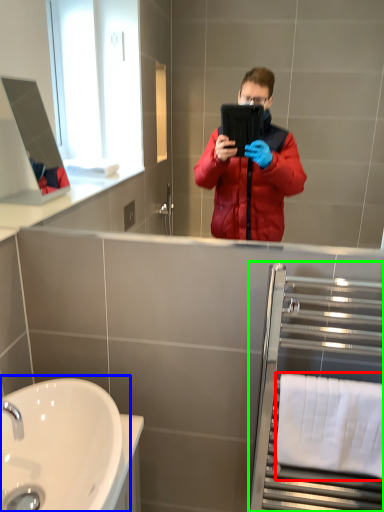
Question: Based on their relative distances, which object is nearer to towel bar (highlighted by a red box)? Choose from sink (highlighted by a blue box) and balustrade (highlighted by a green box).

Choices:
 (A) sink
 (B) balustrade

Answer: (B)